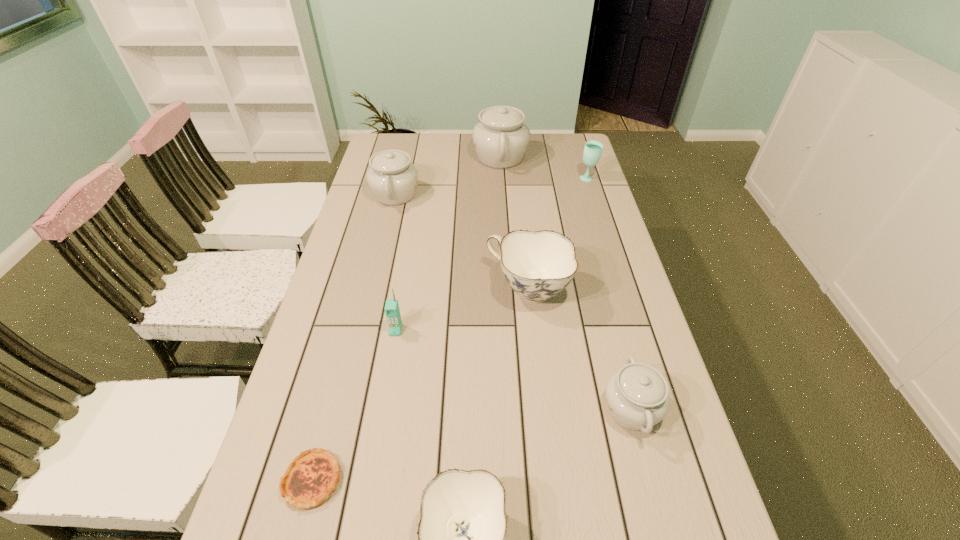
Where is `the seventh closest object relative to the leftmost white chinaware`? The height and width of the screenshot is (540, 960). the seventh closest object relative to the leftmost white chinaware is located at coordinates (461, 534).

Identify which object is the seventh closest to the farther blue chinaware. Please provide its 2D coordinates. Your answer should be formatted as a tuple, i.e. [(x, y)], where the tuple contains the x and y coordinates of a point satisfying the conditions above.

[(501, 138)]

Select which chinaware appears as the closest to the rightmost white chinaware. Please provide its 2D coordinates. Your answer should be formatted as a tuple, i.e. [(x, y)], where the tuple contains the x and y coordinates of a point satisfying the conditions above.

[(539, 265)]

At what (x,y) coordinates should I click in order to perform the action: click on chinaware that stands as the fifth closest to the glass. Please return your answer as a coordinate pair (x, y). Looking at the image, I should click on (461, 534).

I want to click on the closest white chinaware relative to the tallest chinaware, so click(x=392, y=178).

Where is `white chinaware identified as the second closest to the biggest white chinaware`? The height and width of the screenshot is (540, 960). white chinaware identified as the second closest to the biggest white chinaware is located at coordinates (637, 396).

Identify the location of vacant point that satisfies the following two spatial constraints: 1. on the front side of the leftmost white chinaware; 2. on the right side of the smallest white chinaware. This screenshot has width=960, height=540. point(345,409).